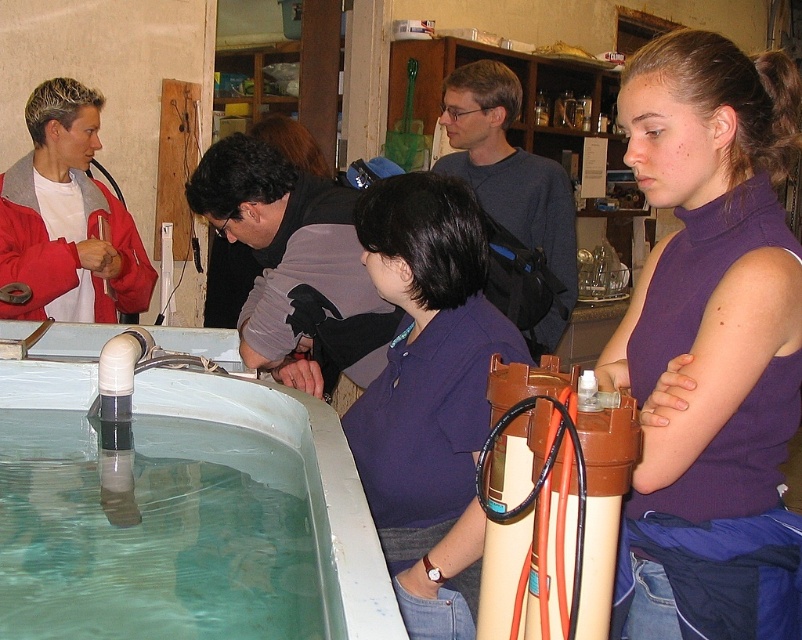
You are standing in the scene and see two points marked in the image. Which point is closer to you, point (647, 109) or point (38, 291)?

Point (647, 109) is in front of point (38, 291), so it is closer to you.

You are an observer standing in front of the tank. You notice two people wearing purple clothing at the center of the image. Which one is wearing the purple turtleneck at center closer to the top of their body compared to the purple cotton shirt at center?

The purple turtleneck at center is located above the purple cotton shirt at center, so the person wearing the purple turtleneck at center has clothing closer to the top of their body compared to the purple cotton shirt at center.